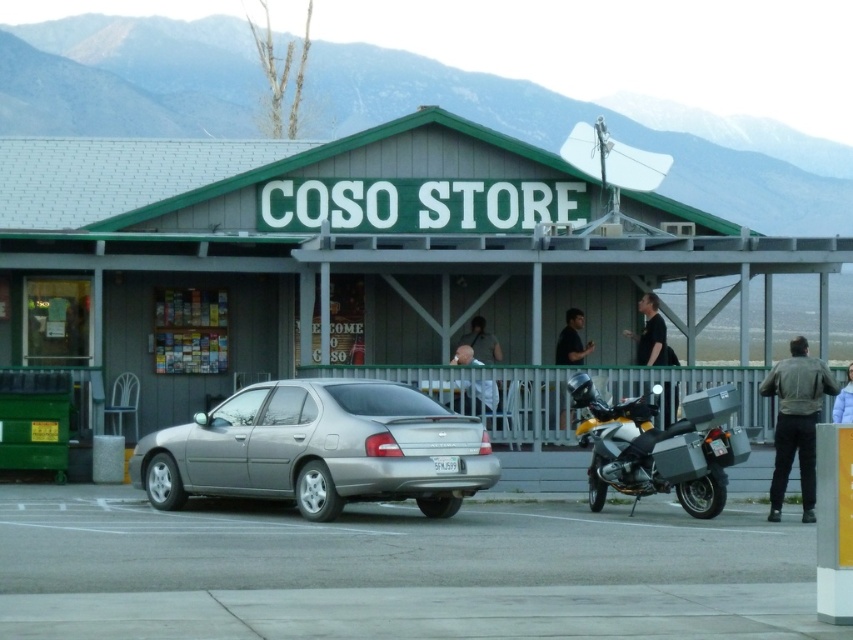
Question: Considering the relative positions of black matte shirt at upper center and black matte shirt at center in the image provided, where is black matte shirt at upper center located with respect to black matte shirt at center?

Choices:
 (A) right
 (B) left

Answer: (A)

Question: Where is matte gray building at center located in relation to black matte shirt at upper center in the image?

Choices:
 (A) above
 (B) below

Answer: (A)

Question: Which is nearer to the black matte shirt at upper center?

Choices:
 (A) leather jacket at right
 (B) white fabric shirt at center
 (C) yellow metallic motorcycle at right
 (D) black matte shirt at center

Answer: (D)

Question: Which object appears closest to the camera in this image?

Choices:
 (A) leather jacket at right
 (B) white puffer jacket at lower right
 (C) black matte shirt at upper center

Answer: (A)

Question: Which point is closer to the camera?

Choices:
 (A) black matte shirt at upper center
 (B) gray asphalt parking lot at lower center
 (C) satin silver sedan at center

Answer: (B)

Question: Can you confirm if yellow metallic motorcycle at right is positioned above black matte shirt at upper center?

Choices:
 (A) no
 (B) yes

Answer: (A)